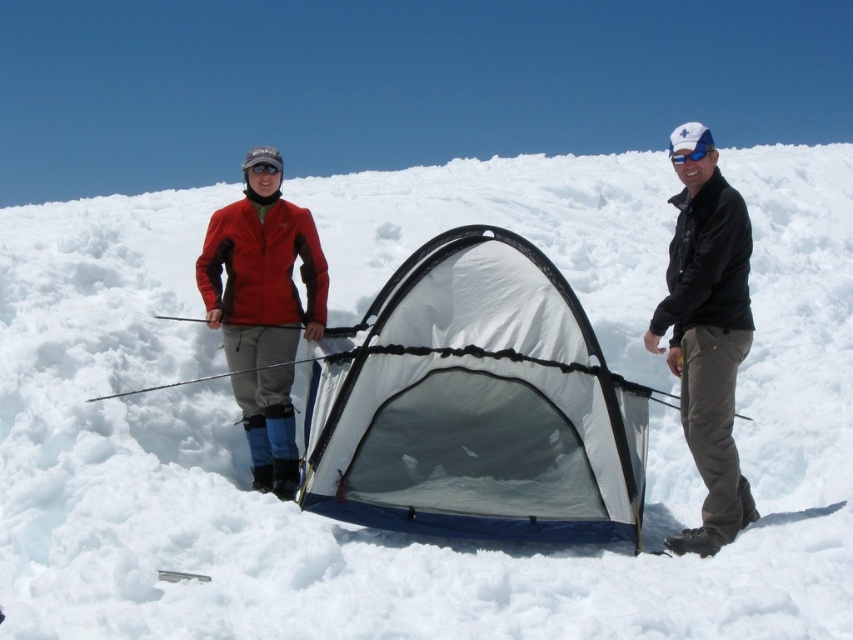
Question: In this image, where is blue reflective lens goggles at upper right located relative to black matte goggles at upper center?

Choices:
 (A) below
 (B) above

Answer: (A)

Question: Can you confirm if blue reflective lens goggles at upper right is wider than black matte goggles at upper center?

Choices:
 (A) no
 (B) yes

Answer: (B)

Question: Which object is closer to the camera taking this photo?

Choices:
 (A) blue reflective lens goggles at upper right
 (B) black leather jacket at right
 (C) black matte goggles at upper center
 (D) matte red jacket at center

Answer: (B)

Question: Among these objects, which one is nearest to the camera?

Choices:
 (A) blue reflective lens goggles at upper right
 (B) black leather jacket at right

Answer: (B)

Question: Which is nearer to the white mesh tent at center?

Choices:
 (A) matte red jacket at center
 (B) black matte goggles at upper center
 (C) black leather jacket at right
 (D) blue reflective lens goggles at upper right

Answer: (A)

Question: Does white mesh tent at center have a greater width compared to matte red jacket at center?

Choices:
 (A) yes
 (B) no

Answer: (A)